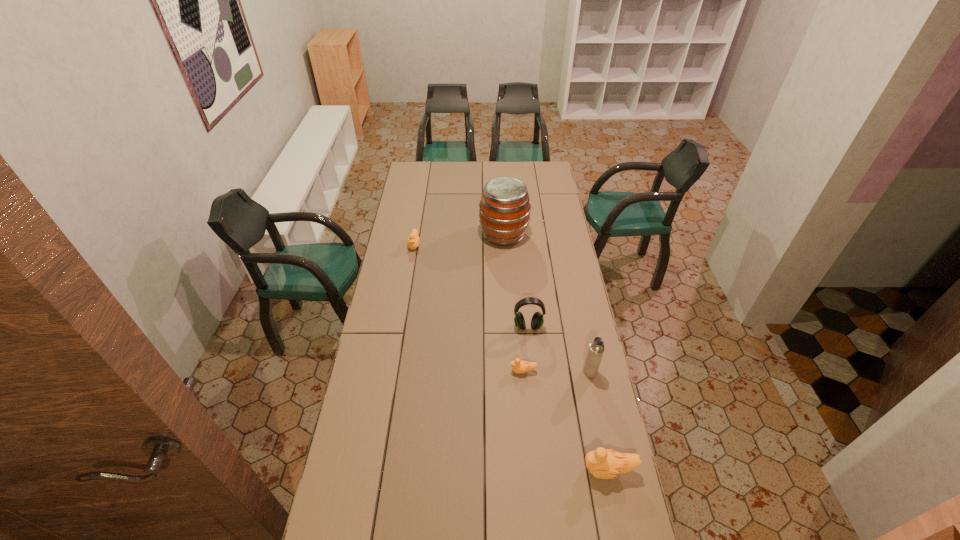
The height and width of the screenshot is (540, 960). Find the location of `vacant area situated on the face of the leftmost duckling`. vacant area situated on the face of the leftmost duckling is located at coordinates (x=412, y=264).

The width and height of the screenshot is (960, 540). In order to click on vacant space located on the face of the second duckling from left to right in this screenshot , I will do `click(427, 371)`.

Locate an element on the screen. free location located on the face of the second duckling from left to right is located at coordinates coord(471,371).

This screenshot has height=540, width=960. Find the location of `vacant space located 0.380m on the face of the second duckling from left to right`. vacant space located 0.380m on the face of the second duckling from left to right is located at coordinates (412, 371).

The height and width of the screenshot is (540, 960). I want to click on free space located 0.350m on the face of the rightmost duckling, so click(x=474, y=470).

Identify the location of vacant area situated 0.070m on the face of the rightmost duckling. Image resolution: width=960 pixels, height=540 pixels. (560, 470).

This screenshot has height=540, width=960. I want to click on free location located on the face of the rightmost duckling, so click(x=566, y=470).

Where is `blank space located 0.190m on the back of the tallest object`? blank space located 0.190m on the back of the tallest object is located at coordinates (501, 200).

Find the location of a particular element. This screenshot has width=960, height=540. vacant position located on the ear cups of the third tallest object is located at coordinates (536, 405).

Where is `free space located on the front of the thermos bottle`? free space located on the front of the thermos bottle is located at coordinates (595, 394).